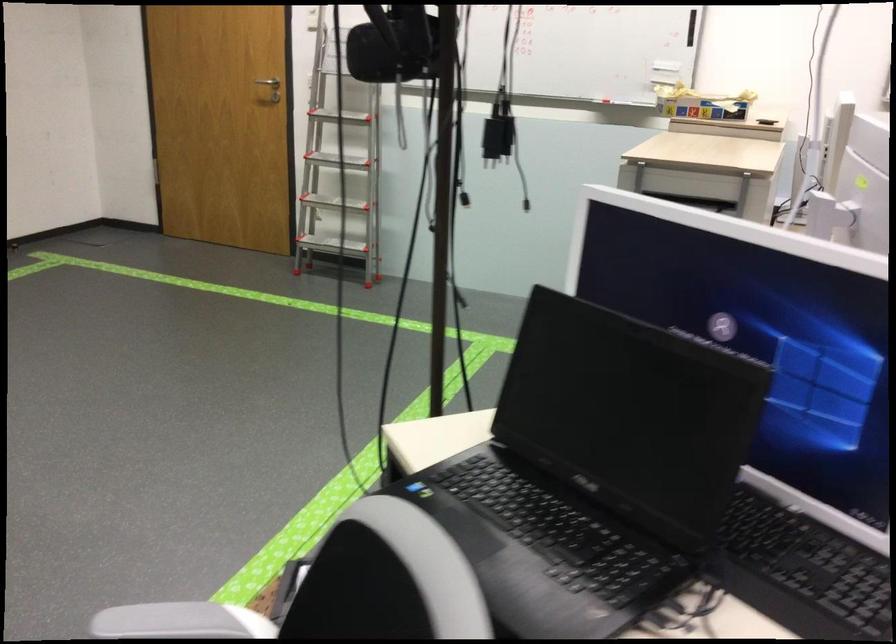
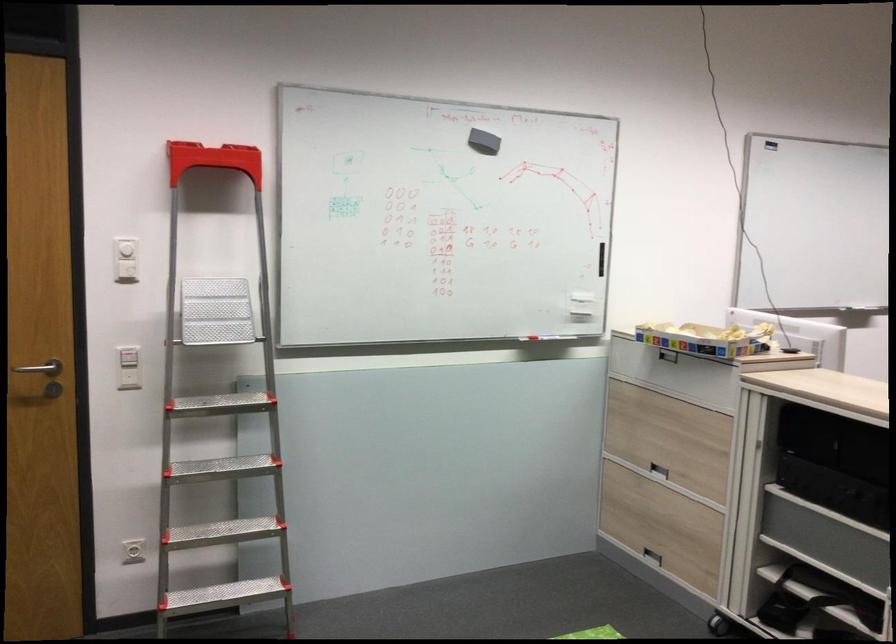
The point at (x=668, y=98) is marked in the first image. Where is the corresponding point in the second image?

(705, 339)